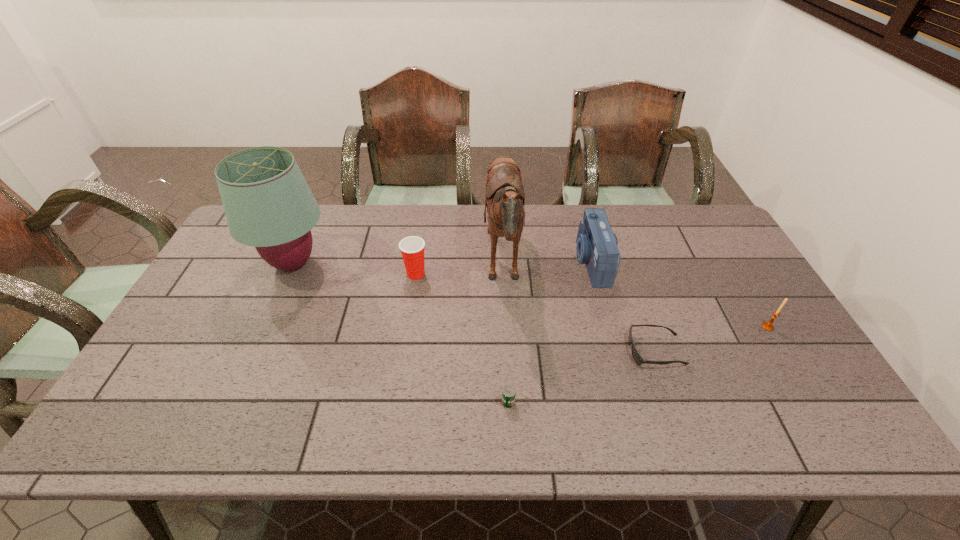
At what (x,y) coordinates should I click in order to perform the action: click on vacant space located on the front-facing side of the sunglasses. Please return your answer as a coordinate pair (x, y). Image resolution: width=960 pixels, height=540 pixels. Looking at the image, I should click on (483, 350).

This screenshot has height=540, width=960. Identify the location of vacant region located 0.060m on the front-facing side of the sunglasses. (606, 350).

Where is `free location located 0.330m on the front-facing side of the sunglasses`? The height and width of the screenshot is (540, 960). free location located 0.330m on the front-facing side of the sunglasses is located at coordinates (502, 350).

This screenshot has height=540, width=960. What are the coordinates of `saddle that is at the far edge` in the screenshot? It's located at (505, 197).

I want to click on lampshade located in the far edge section of the desktop, so click(x=268, y=204).

Where is `camera located at the far edge`? camera located at the far edge is located at coordinates (596, 247).

This screenshot has height=540, width=960. What are the coordinates of `object situated at the near edge` in the screenshot? It's located at (508, 395).

Locate an element on the screen. object present at the left edge is located at coordinates (268, 204).

Locate an element on the screen. object positioned at the right edge is located at coordinates (768, 326).

I want to click on object located at the far left corner, so click(268, 204).